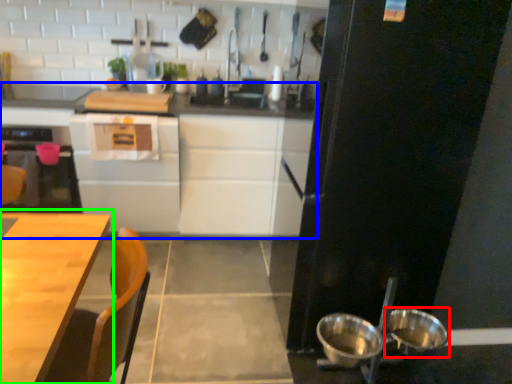
Question: Based on their relative distances, which object is nearer to bowl (highlighted by a red box)? Choose from cabinetry (highlighted by a blue box) and table (highlighted by a green box).

Choices:
 (A) cabinetry
 (B) table

Answer: (B)